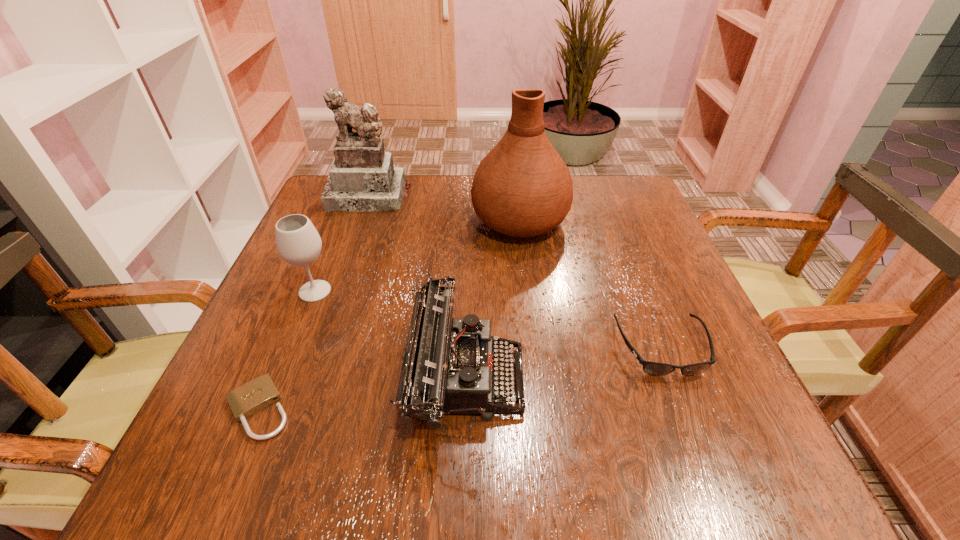
Identify the location of free spot between the pitcher and the sunglasses. The image size is (960, 540). (590, 283).

At what (x,y) coordinates should I click in order to perform the action: click on empty space that is in between the pitcher and the padlock. Please return your answer as a coordinate pair (x, y). The height and width of the screenshot is (540, 960). Looking at the image, I should click on (389, 314).

The width and height of the screenshot is (960, 540). In order to click on free spot between the figurine and the shortest object in this screenshot , I will do `click(314, 302)`.

At what (x,y) coordinates should I click in order to perform the action: click on vacant region between the typewriter and the fifth tallest object. Please return your answer as a coordinate pair (x, y). The height and width of the screenshot is (540, 960). Looking at the image, I should click on (564, 362).

The image size is (960, 540). In order to click on free spot between the fifth tallest object and the pitcher in this screenshot , I will do `click(590, 283)`.

The image size is (960, 540). I want to click on free space that is in between the figurine and the fourth tallest object, so click(417, 286).

Image resolution: width=960 pixels, height=540 pixels. I want to click on free space between the figurine and the pitcher, so tap(444, 207).

Locate an element on the screen. The image size is (960, 540). vacant region between the padlock and the figurine is located at coordinates (314, 302).

This screenshot has width=960, height=540. Identify the location of free space between the figurine and the shortest object. (314, 302).

Locate an element on the screen. The width and height of the screenshot is (960, 540). object that can be found as the second closest to the shortest object is located at coordinates (449, 365).